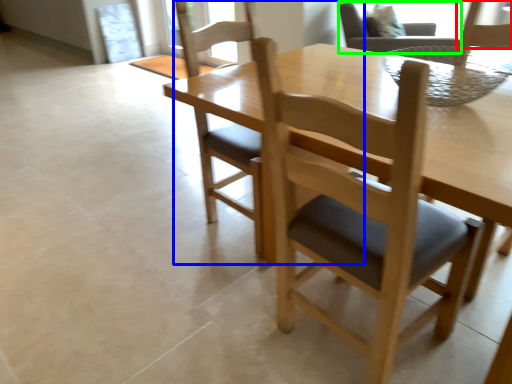
Question: Considering the real-world distances, which object is closest to chair (highlighted by a red box)? chair (highlighted by a blue box) or chair (highlighted by a green box).

Choices:
 (A) chair
 (B) chair

Answer: (A)